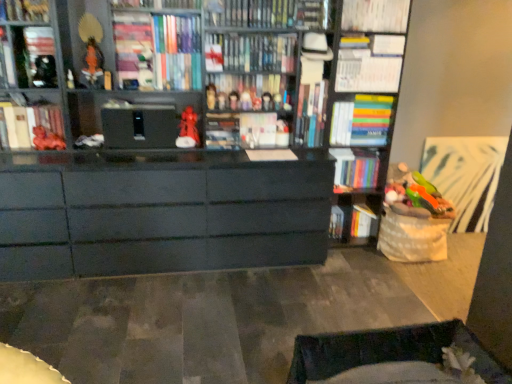
Question: Is white paper at upper center, the 11th book when ordered from left to right, located outside matte red figurine at center, which is the second toy in right-to-left order?

Choices:
 (A) no
 (B) yes

Answer: (B)

Question: Does white paper at upper center, the 3th book in the right-to-left sequence, have a greater width compared to matte red figurine at center, which is the second toy in right-to-left order?

Choices:
 (A) no
 (B) yes

Answer: (B)

Question: Does white paper at upper center, the 11th book when ordered from left to right, have a smaller size compared to matte red figurine at center, the 6th toy viewed from the left?

Choices:
 (A) no
 (B) yes

Answer: (A)

Question: Does white paper at upper center, the 11th book when ordered from left to right, appear on the left side of matte red figurine at center, the 6th toy viewed from the left?

Choices:
 (A) no
 (B) yes

Answer: (A)

Question: From the image's perspective, is white paper at upper center, the 3th book in the right-to-left sequence, under matte red figurine at center, which is the second toy in right-to-left order?

Choices:
 (A) no
 (B) yes

Answer: (A)

Question: Choose the correct answer: Is matte black book at upper left, the 1th book when ordered from left to right, inside matte white paperback book at center, which is the 1th paperback book in right-to-left order, or outside it?

Choices:
 (A) inside
 (B) outside

Answer: (B)

Question: Looking at the image, does matte black book at upper left, the 1th book when ordered from left to right, seem bigger or smaller compared to matte white paperback book at center, which appears as the 2th paperback book when viewed from the left?

Choices:
 (A) big
 (B) small

Answer: (B)

Question: Looking at their shapes, would you say matte black book at upper left, the thirteenth book positioned from the right, is wider or thinner than matte white paperback book at center, which appears as the 2th paperback book when viewed from the left?

Choices:
 (A) wide
 (B) thin

Answer: (B)

Question: From the image's perspective, is matte black book at upper left, the thirteenth book positioned from the right, above or below matte white paperback book at center, which appears as the 2th paperback book when viewed from the left?

Choices:
 (A) above
 (B) below

Answer: (A)

Question: From a real-world perspective, relative to matte white book at left, marked as the twelfth book in a right-to-left arrangement, is multicolored hardcover book at upper right, arranged as the twelfth book when viewed from the left, vertically above or below?

Choices:
 (A) above
 (B) below

Answer: (A)

Question: From the image's perspective, is multicolored hardcover book at upper right, arranged as the twelfth book when viewed from the left, located above or below matte white book at left, marked as the twelfth book in a right-to-left arrangement?

Choices:
 (A) below
 (B) above

Answer: (B)

Question: Is point (335, 142) closer or farther from the camera than point (28, 129)?

Choices:
 (A) closer
 (B) farther

Answer: (B)

Question: Is multicolored hardcover book at upper right, arranged as the twelfth book when viewed from the left, to the left or to the right of matte white book at left, marked as the twelfth book in a right-to-left arrangement, in the image?

Choices:
 (A) right
 (B) left

Answer: (A)

Question: Visually, is matte black bookshelf at upper left, which appears as the 11th book when viewed from the right, positioned to the left or to the right of hardcover book at center, the 6th book when ordered from left to right?

Choices:
 (A) left
 (B) right

Answer: (A)

Question: Considering the positions of point (16, 18) and point (247, 66), is point (16, 18) closer or farther from the camera than point (247, 66)?

Choices:
 (A) farther
 (B) closer

Answer: (B)